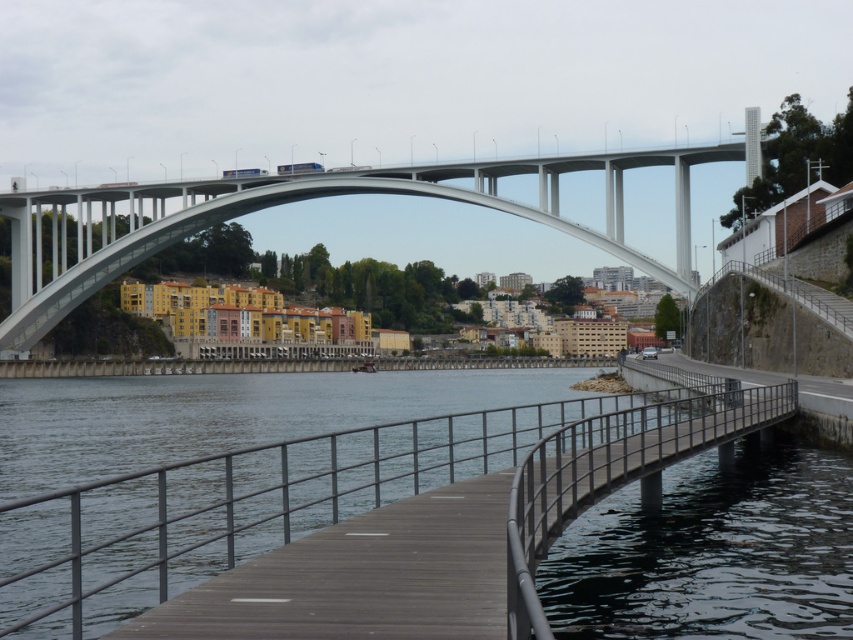
You are standing at the center of the image and want to walk towards the wooden at center. In which direction should you move relative to the current position?

The wooden at center is located at point [340,496] in 2D coordinates, so you should move to the right and slightly downward to reach it.

You are a city planner assessing the height of structures in the urban area. Given the scene described, which structure is taller between the wooden at center and the white concrete arch bridge at upper center?

The white concrete arch bridge at upper center is taller than the wooden at center, as stated in the description.